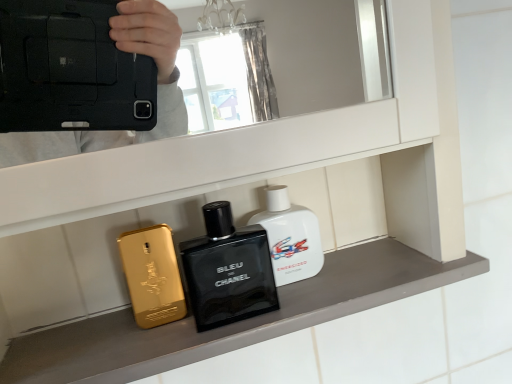
You are a GUI agent. You are given a task and a screenshot of the screen. Output one action in this format:
    pyautogui.click(x=<x>, y=<y>)
    Task: Click on the vacant area located to the right-hand side of white glossy bottle at center, the 2th perfume in the left-to-right sequence
    The height and width of the screenshot is (384, 512).
    Given the screenshot: What is the action you would take?
    pyautogui.click(x=377, y=257)